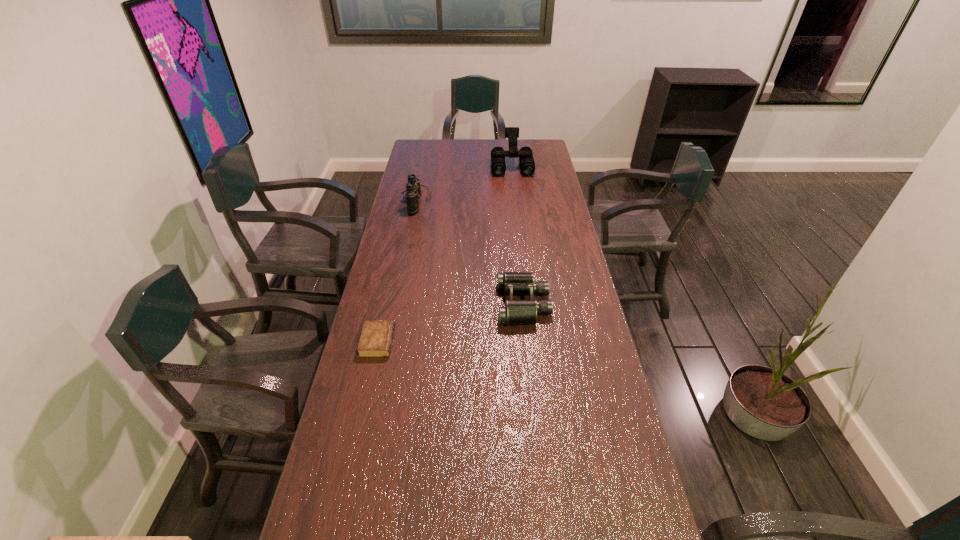
This screenshot has height=540, width=960. Identify the location of free location located 0.300m on the front-facing side of the shortest binoculars. (412, 304).

Locate an element on the screen. The height and width of the screenshot is (540, 960). free space located on the front-facing side of the shortest binoculars is located at coordinates (435, 304).

Where is `free location located 0.390m on the spine side of the diary`? This screenshot has width=960, height=540. free location located 0.390m on the spine side of the diary is located at coordinates (516, 342).

You are a GUI agent. You are given a task and a screenshot of the screen. Output one action in this format:
    pyautogui.click(x=<x>, y=<y>)
    Task: Click on the object that is at the far edge
    The width and height of the screenshot is (960, 540).
    Given the screenshot: What is the action you would take?
    pyautogui.click(x=498, y=164)

Where is `binoculars positioned at the left edge`? The height and width of the screenshot is (540, 960). binoculars positioned at the left edge is located at coordinates pos(413,189).

At what (x,y) coordinates should I click in order to perform the action: click on diary situated at the left edge. Please return your answer as a coordinate pair (x, y). The image size is (960, 540). Looking at the image, I should click on (376, 338).

Identify the location of object present at the far right corner. This screenshot has height=540, width=960. (498, 164).

The height and width of the screenshot is (540, 960). Identify the location of vacant space at the far edge of the desktop. (508, 145).

You are a GUI agent. You are given a task and a screenshot of the screen. Output one action in this format:
    pyautogui.click(x=<x>, y=<y>)
    Task: Click on the free space at the left edge of the desktop
    This screenshot has height=540, width=960.
    Given the screenshot: What is the action you would take?
    pyautogui.click(x=428, y=173)

Identify the location of vacant area at the right edge. The height and width of the screenshot is (540, 960). (575, 381).